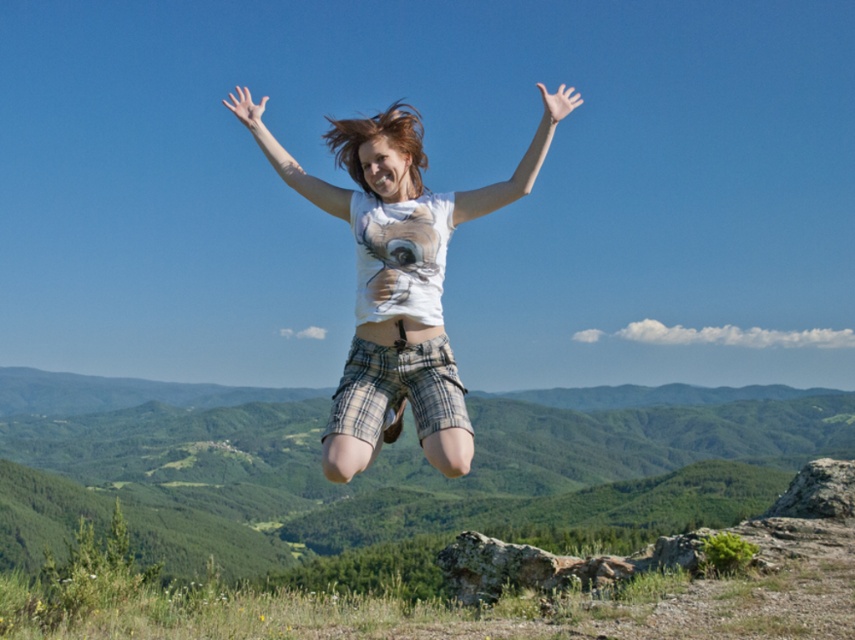
Is white cotton t-shirt at center to the right of white matte arm at center from the viewer's perspective?

Indeed, white cotton t-shirt at center is positioned on the right side of white matte arm at center.

Is white cotton t-shirt at center to the left of white matte arm at center from the viewer's perspective?

Incorrect, white cotton t-shirt at center is not on the left side of white matte arm at center.

Who is more distant from viewer, (x=435, y=372) or (x=293, y=182)?

Point (x=293, y=182)

This screenshot has width=855, height=640. I want to click on white cotton t-shirt at center, so click(x=398, y=276).

Is white matte arm at upper center to the left of white matte arm at center from the viewer's perspective?

Incorrect, white matte arm at upper center is not on the left side of white matte arm at center.

Does white matte arm at upper center appear on the right side of white matte arm at center?

Indeed, white matte arm at upper center is positioned on the right side of white matte arm at center.

Is point (564, 108) less distant than point (251, 104)?

That is True.

I want to click on white matte arm at upper center, so click(x=519, y=161).

Is point (419, 131) behind point (549, 116)?

That is True.

Who is positioned more to the right, white cotton t-shirt at center or white matte arm at upper center?

white matte arm at upper center

Is point (404, 152) positioned in front of point (537, 156)?

No, (404, 152) is behind (537, 156).

Identify the location of white cotton t-shirt at center. The height and width of the screenshot is (640, 855). (398, 276).